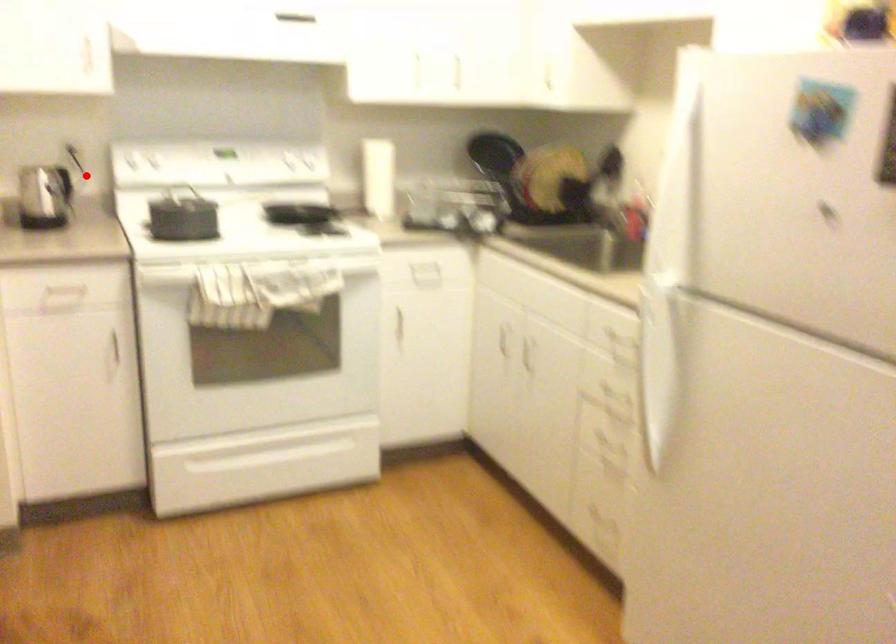
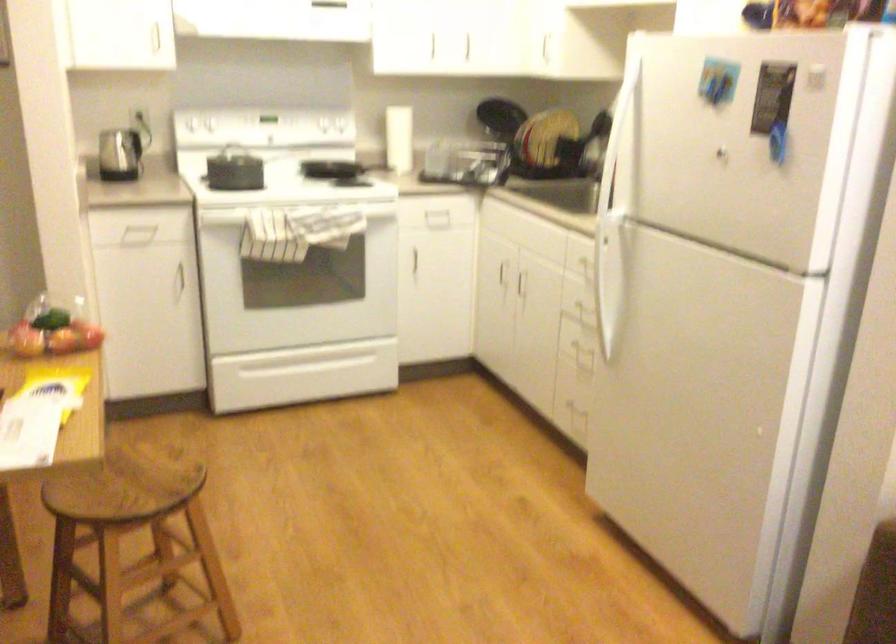
Question: I am providing you with two images of the same scene from different viewpoints. A red point is shown in image1. For the corresponding object point in image2, is it positioned nearer or farther from the camera?

Choices:
 (A) Nearer
 (B) Farther

Answer: (B)